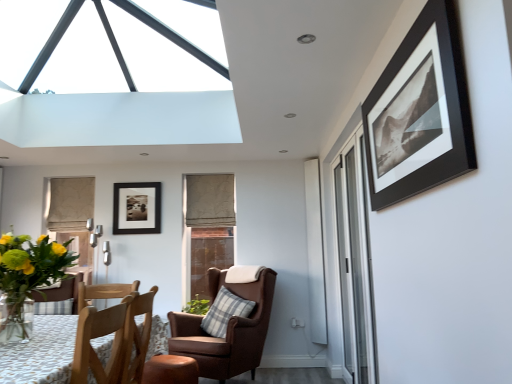
The image size is (512, 384). What do you see at coordinates (114, 340) in the screenshot?
I see `wooden chair at lower left, which ranks as the 1th chair in front-to-back order` at bounding box center [114, 340].

Describe the element at coordinates (114, 75) in the screenshot. I see `transparent glass window at upper center, the first window from the top` at that location.

Image resolution: width=512 pixels, height=384 pixels. What do you see at coordinates (420, 110) in the screenshot? I see `black matte picture frame at upper right, which is the 2th picture frame from left to right` at bounding box center [420, 110].

Locate an element on the screen. Image resolution: width=512 pixels, height=384 pixels. wooden chair at lower left, which ranks as the 1th chair in front-to-back order is located at coordinates (114, 340).

From the image's perspective, is wooden desk at lower left above or below wooden chair at lower left, which ranks as the 1th chair in front-to-back order?

Clearly, from the image's perspective, wooden desk at lower left is above wooden chair at lower left, which ranks as the 1th chair in front-to-back order.

Are wooden desk at lower left and wooden chair at lower left, positioned as the second chair in back-to-front order, making contact?

They are not placed beside each other.

Between point (50, 334) and point (141, 380), which one is positioned in front?

The point (50, 334) is more forward.

Can you confirm if wooden desk at lower left is positioned to the right of wooden chair at lower left, positioned as the second chair in back-to-front order?

Correct, you'll find wooden desk at lower left to the right of wooden chair at lower left, positioned as the second chair in back-to-front order.

From the picture: From the image's perspective, relative to wooden desk at lower left, is black matte picture frame at upper right, which is the 2th picture frame from left to right, above or below?

black matte picture frame at upper right, which is the 2th picture frame from left to right, is above wooden desk at lower left.

From a real-world perspective, relative to wooden desk at lower left, is black matte picture frame at upper right, which is counted as the first picture frame, starting from the front, vertically above or below?

black matte picture frame at upper right, which is counted as the first picture frame, starting from the front, is situated higher than wooden desk at lower left in the real world.

Considering the sizes of objects black matte picture frame at upper right, which ranks as the first picture frame in right-to-left order, and wooden desk at lower left in the image provided, who is smaller, black matte picture frame at upper right, which ranks as the first picture frame in right-to-left order, or wooden desk at lower left?

black matte picture frame at upper right, which ranks as the first picture frame in right-to-left order.

Is point (422, 25) closer to camera compared to point (45, 339)?

That is True.

From a real-world perspective, between green leafy plant at lower left and beige fabric curtain at center, who is vertically higher?

beige fabric curtain at center, from a real-world perspective.

Can you confirm if green leafy plant at lower left is positioned to the left of beige fabric curtain at center?

Yes.

Which of these two, green leafy plant at lower left or beige fabric curtain at center, is thinner?

Thinner between the two is beige fabric curtain at center.

Is point (26, 280) positioned behind point (189, 225)?

That is False.

Considering the positions of objects black matte picture frame at upper right, which is the 2th picture frame from left to right, and clear glass door at right in the image provided, who is more to the right, black matte picture frame at upper right, which is the 2th picture frame from left to right, or clear glass door at right?

From the viewer's perspective, clear glass door at right appears more on the right side.

From a real-world perspective, starting from the clear glass door at right, which picture frame is the 1st one vertically above it? Please provide its 2D coordinates.

[(420, 110)]

Measure the distance from black matte picture frame at upper right, which is the 2th picture frame from left to right, to clear glass door at right.

They are 1.14 meters apart.

How many degrees apart are the facing directions of black matte picture frame at upper right, which is counted as the first picture frame, starting from the front, and clear glass door at right?

0.283 degrees separate the facing orientations of black matte picture frame at upper right, which is counted as the first picture frame, starting from the front, and clear glass door at right.

Considering the sizes of objects transparent glass window at upper center, the second window from the right, and plaid fabric pillow at center in the image provided, who is shorter, transparent glass window at upper center, the second window from the right, or plaid fabric pillow at center?

transparent glass window at upper center, the second window from the right.

Identify the location of window in front of the plaid fabric pillow at center. [x=114, y=75].

Is plaid fabric pillow at center inside transparent glass window at upper center, which appears as the second window when viewed from the back?

No, plaid fabric pillow at center is not a part of transparent glass window at upper center, which appears as the second window when viewed from the back.

From a real-world perspective, between transparent glass window at upper center, positioned as the first window in left-to-right order, and plaid fabric pillow at center, who is vertically higher?

From a 3D spatial view, transparent glass window at upper center, positioned as the first window in left-to-right order, is above.

Which point is more forward, (29,263) or (58,342)?

Positioned in front is point (58,342).

From the image's perspective, is green leafy plant at lower left located above or below wooden desk at lower left?

green leafy plant at lower left is situated higher than wooden desk at lower left in the image.

Which is correct: green leafy plant at lower left is inside wooden desk at lower left, or outside of it?

green leafy plant at lower left is spatially situated outside wooden desk at lower left.

Is green leafy plant at lower left oriented towards wooden desk at lower left?

No, green leafy plant at lower left is not facing towards wooden desk at lower left.

Is leather wingback chair with plaid pillow at center, arranged as the 1th chair when viewed from the back, shorter than clear glass window at center, placed as the 2th window when sorted from front to back?

Incorrect, the height of leather wingback chair with plaid pillow at center, arranged as the 1th chair when viewed from the back, does not fall short of that of clear glass window at center, placed as the 2th window when sorted from front to back.

Is leather wingback chair with plaid pillow at center, which is counted as the second chair, starting from the front, beside clear glass window at center, placed as the 2th window when sorted from front to back?

No, leather wingback chair with plaid pillow at center, which is counted as the second chair, starting from the front, is not next to clear glass window at center, placed as the 2th window when sorted from front to back.

Considering the relative positions of leather wingback chair with plaid pillow at center, which is counted as the second chair, starting from the front, and clear glass window at center, the 1th window in the back-to-front sequence, in the image provided, is leather wingback chair with plaid pillow at center, which is counted as the second chair, starting from the front, in front of clear glass window at center, the 1th window in the back-to-front sequence,?

Yes.

Find the location of a particular element. chair on the left side of wooden desk at lower left is located at coordinates (114, 340).

Where is `desk below the black matte picture frame at upper right, which is counted as the first picture frame, starting from the front (from a real-world perspective)`? The width and height of the screenshot is (512, 384). desk below the black matte picture frame at upper right, which is counted as the first picture frame, starting from the front (from a real-world perspective) is located at coordinates (41, 353).

Based on their spatial positions, is transparent glass window at upper center, the second window from the right, or clear glass door at right further from black matte picture frame at upper right, which ranks as the first picture frame in right-to-left order?

The object further to black matte picture frame at upper right, which ranks as the first picture frame in right-to-left order, is transparent glass window at upper center, the second window from the right.

Based on their spatial positions, is matte black picture frame at center, the first picture frame when ordered from back to front, or clear glass window at center, marked as the second window in a left-to-right arrangement, closer to transparent glass window at upper center, the second window from the right?

The object closer to transparent glass window at upper center, the second window from the right, is matte black picture frame at center, the first picture frame when ordered from back to front.

Estimate the real-world distances between objects in this image. Which object is further from beige fabric curtain at center, clear glass door at right or matte black picture frame at center, the first picture frame when ordered from back to front?

clear glass door at right is positioned further to the anchor beige fabric curtain at center.

Which object lies further to the anchor point wooden desk at lower left, green leafy plant at lower left or clear glass window at center, the 1th window in the back-to-front sequence?

clear glass window at center, the 1th window in the back-to-front sequence.

Which object lies nearer to the anchor point leather wingback chair with plaid pillow at center, which is counted as the second chair, starting from the front, wooden chair at lower left, positioned as the second chair in back-to-front order, or matte black picture frame at center, the first picture frame when ordered from back to front?

Based on the image, matte black picture frame at center, the first picture frame when ordered from back to front, appears to be nearer to leather wingback chair with plaid pillow at center, which is counted as the second chair, starting from the front.

Which object lies further to the anchor point matte black picture frame at center, acting as the second picture frame starting from the right, wooden desk at lower left or black matte picture frame at upper right, which ranks as the first picture frame in right-to-left order?

black matte picture frame at upper right, which ranks as the first picture frame in right-to-left order, lies further to matte black picture frame at center, acting as the second picture frame starting from the right, than the other object.

Looking at the image, which one is located closer to leather wingback chair with plaid pillow at center, which is counted as the second chair, starting from the front, beige fabric curtain at center or matte black picture frame at center, acting as the second picture frame starting from the right?

beige fabric curtain at center is closer to leather wingback chair with plaid pillow at center, which is counted as the second chair, starting from the front.

Looking at the image, which one is located further to beige fabric curtain at center, clear glass door at right or wooden desk at lower left?

Among the two, wooden desk at lower left is located further to beige fabric curtain at center.

This screenshot has width=512, height=384. I want to click on window between wooden desk at lower left and plaid fabric pillow at center in the front-back direction, so click(x=114, y=75).

Find the location of a particular element. The height and width of the screenshot is (384, 512). glass door between green leafy plant at lower left and matte black picture frame at center, placed as the 2th picture frame when sorted from front to back, from front to back is located at coordinates tap(354, 262).

The height and width of the screenshot is (384, 512). Find the location of `houseplant between transparent glass window at upper center, the first window from the top, and plaid fabric pillow at center in the front-back direction`. houseplant between transparent glass window at upper center, the first window from the top, and plaid fabric pillow at center in the front-back direction is located at coordinates (27, 280).

Find the location of a particular element. The height and width of the screenshot is (384, 512). houseplant between black matte picture frame at upper right, which is the 2th picture frame from left to right, and matte black picture frame at center, placed as the 2th picture frame when sorted from front to back, along the z-axis is located at coordinates (27, 280).